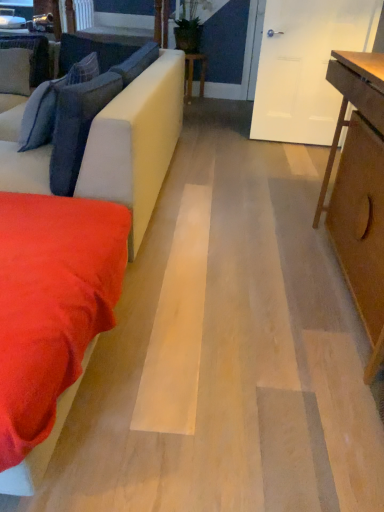
Question: From the image's perspective, relative to velvet blue pillow at upper left, the second pillow positioned from the back, is suede-like beige couch at left above or below?

Choices:
 (A) above
 (B) below

Answer: (B)

Question: From a real-world perspective, relative to velvet blue pillow at upper left, the second pillow positioned from the back, is suede-like beige couch at left vertically above or below?

Choices:
 (A) below
 (B) above

Answer: (A)

Question: Estimate the real-world distances between objects in this image. Which object is closer to the wooden table at center, which appears as the first table when viewed from the back?

Choices:
 (A) light brown wooden table at right, the second table positioned from the top
 (B) suede-like beige couch at left
 (C) velvety blue pillow at left, acting as the 4th pillow starting from the back
 (D) suede-like red blanket at lower left
 (E) suede-like gray pillow at upper left, which is the fourth pillow in front-to-back order

Answer: (E)

Question: Which is farther from the suede-like beige couch at left?

Choices:
 (A) suede-like red blanket at lower left
 (B) velvety blue pillow at left, acting as the 4th pillow starting from the back
 (C) wooden table at center, which appears as the first table when viewed from the back
 (D) velvet blue pillow at upper left, which appears as the third pillow when viewed from the front
 (E) suede-like gray pillow at upper left, which is the fourth pillow in front-to-back order

Answer: (C)